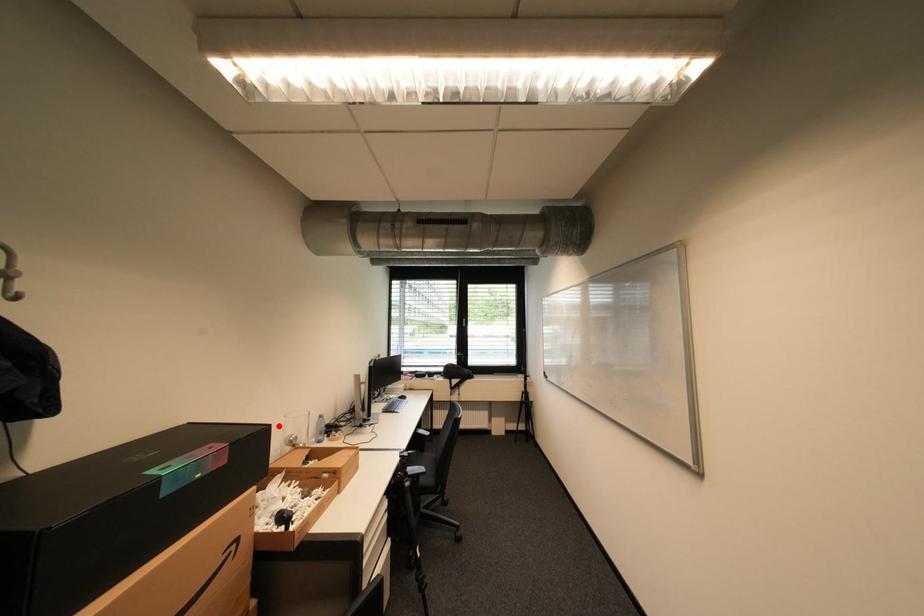
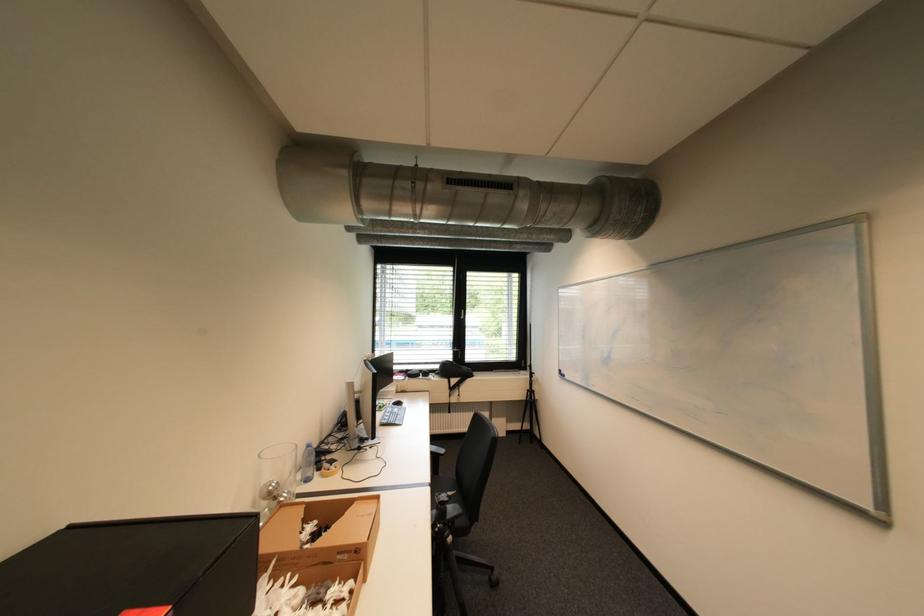
Question: A red point is marked in image1. In image2, is the corresponding 3D point closer to the camera or farther? Reply with the corresponding letter.

Choices:
 (A) The corresponding 3D point is closer.
 (B) The corresponding 3D point is farther.

Answer: (A)